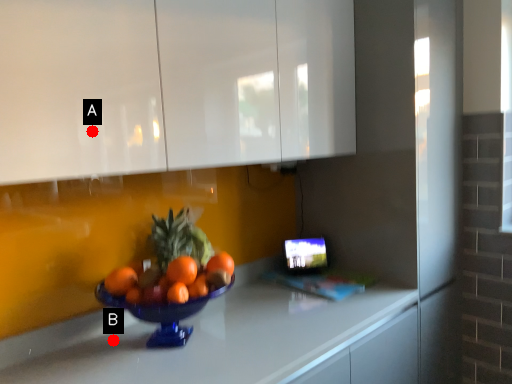
Question: Two points are circled on the image, labeled by A and B beside each circle. Among these points, which one is farthest from the camera?

Choices:
 (A) A is further
 (B) B is further

Answer: (B)